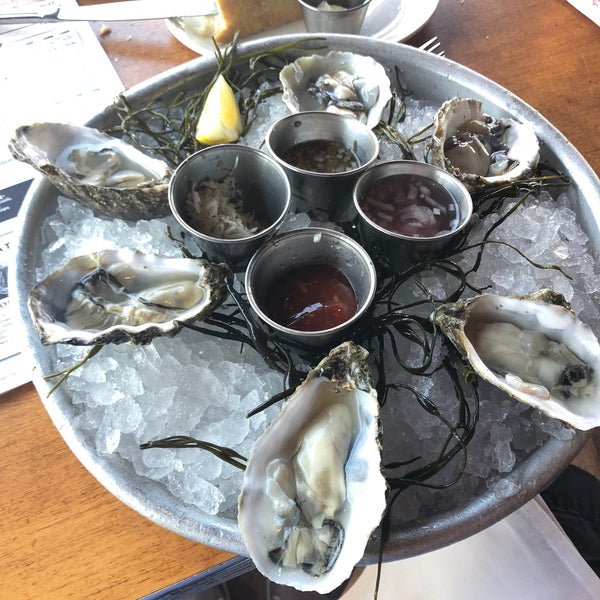
You are a GUI agent. You are given a task and a screenshot of the screen. Output one action in this format:
    pyautogui.click(x=<x>, y=<y>)
    Task: Click on the small plate
    This screenshot has width=600, height=600.
    Given the screenshot: What is the action you would take?
    pyautogui.click(x=418, y=12)